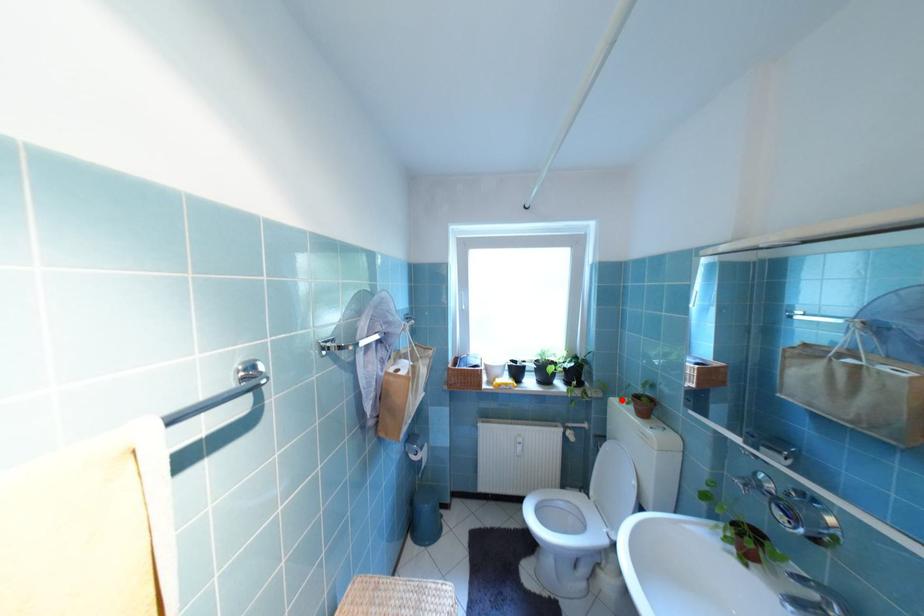
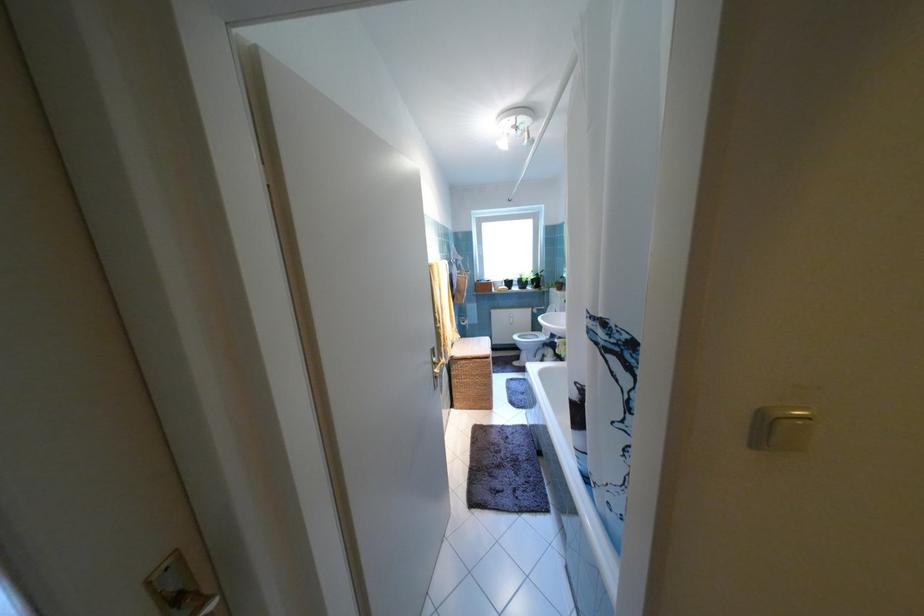
The point at the highlighted location is marked in the first image. Where is the corresponding point in the second image?

(561, 290)